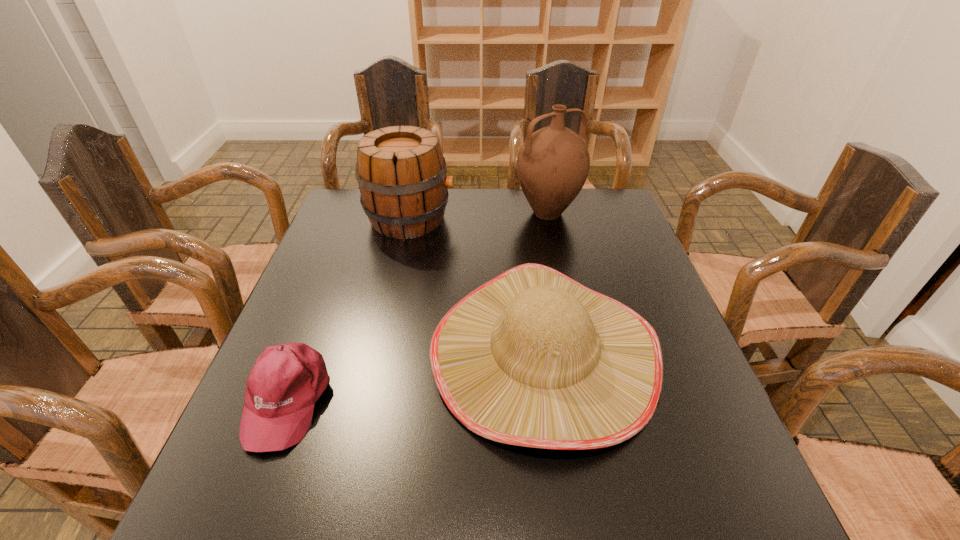
Where is `vacant space at the far right corner`? The width and height of the screenshot is (960, 540). vacant space at the far right corner is located at coordinates 603,193.

What are the coordinates of `free space between the shortest object and the second tallest object` in the screenshot? It's located at (348, 309).

You are a GUI agent. You are given a task and a screenshot of the screen. Output one action in this format:
    pyautogui.click(x=<x>, y=<y>)
    Task: Click on the free space that is in between the sunhat and the shortest object
    The width and height of the screenshot is (960, 540).
    Given the screenshot: What is the action you would take?
    pyautogui.click(x=416, y=376)

What are the coordinates of `vacant area between the second shortest object and the shortest object` in the screenshot? It's located at (416, 376).

Where is `empty space between the second tallest object and the sunhat`? This screenshot has height=540, width=960. empty space between the second tallest object and the sunhat is located at coordinates (477, 286).

What are the coordinates of `unoccupied area between the baseball cap and the tallest object` in the screenshot? It's located at (418, 306).

Identify the location of vacant area that lies between the pitcher and the second tallest object. (479, 216).

Where is `free space between the shortest object and the cider`? free space between the shortest object and the cider is located at coordinates (348, 309).

This screenshot has width=960, height=540. I want to click on the third closest object relative to the baseball cap, so click(553, 163).

Identify the location of object that ranks as the second closest to the third tallest object. This screenshot has width=960, height=540. (287, 380).